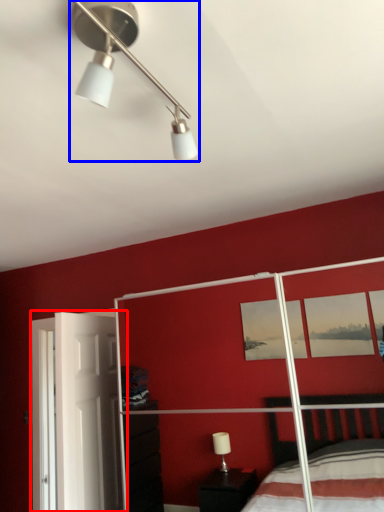
Question: Which point is further to the camera, screen door (highlighted by a red box) or lamp (highlighted by a blue box)?

Choices:
 (A) screen door
 (B) lamp

Answer: (A)